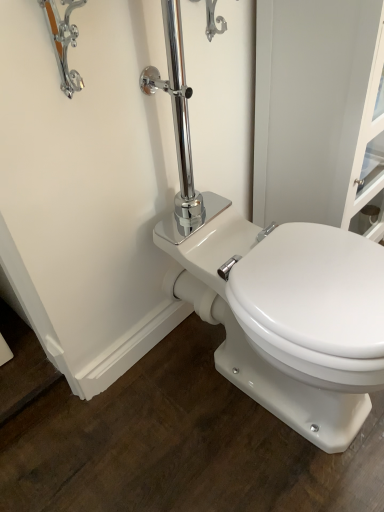
The image size is (384, 512). What do you see at coordinates (63, 41) in the screenshot?
I see `chrome metallic faucet at upper left` at bounding box center [63, 41].

Identify the location of white glossy screen door at upper right. (319, 113).

Identify the location of chrome metallic faucet at upper left. Image resolution: width=384 pixels, height=512 pixels. (63, 41).

Considering the points (75, 85) and (269, 333), which point is in front, point (75, 85) or point (269, 333)?

The point (75, 85) is closer to the camera.

In the scene shown: How many degrees apart are the facing directions of chrome metallic faucet at upper left and white glossy porcelain toilet at center?

There is a 0.0018-degree angle between the facing directions of chrome metallic faucet at upper left and white glossy porcelain toilet at center.

Is chrome metallic faucet at upper left in front of white glossy porcelain toilet at center?

Yes, it is.

From the image's perspective, which one is positioned higher, chrome metallic faucet at upper left or white glossy porcelain toilet at center?

chrome metallic faucet at upper left is shown above in the image.

The image size is (384, 512). Identify the location of faucet that appears above the white glossy screen door at upper right (from a real-world perspective). (63, 41).

From the image's perspective, is white glossy screen door at upper right above chrome metallic faucet at upper left?

No.

How much distance is there between white glossy screen door at upper right and chrome metallic faucet at upper left?

white glossy screen door at upper right and chrome metallic faucet at upper left are 25.18 inches apart from each other.

In terms of height, does white glossy screen door at upper right look taller or shorter compared to chrome metallic faucet at upper left?

white glossy screen door at upper right is taller than chrome metallic faucet at upper left.

Based on the photo, considering the relative sizes of white glossy screen door at upper right and white glossy porcelain toilet at center in the image provided, is white glossy screen door at upper right bigger than white glossy porcelain toilet at center?

Correct, white glossy screen door at upper right is larger in size than white glossy porcelain toilet at center.

Is white glossy screen door at upper right far away from white glossy porcelain toilet at center?

white glossy screen door at upper right is actually quite close to white glossy porcelain toilet at center.

Measure the distance between white glossy screen door at upper right and white glossy porcelain toilet at center.

They are 14.56 inches apart.

In the scene shown: Which is behind, white glossy screen door at upper right or white glossy porcelain toilet at center?

white glossy screen door at upper right is more distant.

Between chrome metallic faucet at upper left and white glossy screen door at upper right, which one has larger size?

white glossy screen door at upper right is bigger.

Can you confirm if chrome metallic faucet at upper left is thinner than white glossy screen door at upper right?

Indeed, chrome metallic faucet at upper left has a lesser width compared to white glossy screen door at upper right.

Is chrome metallic faucet at upper left not within white glossy screen door at upper right?

That's correct, chrome metallic faucet at upper left is outside of white glossy screen door at upper right.

Is chrome metallic faucet at upper left to the left or to the right of white glossy screen door at upper right in the image?

In the image, chrome metallic faucet at upper left appears on the left side of white glossy screen door at upper right.

Locate an element on the screen. Image resolution: width=384 pixels, height=512 pixels. screen door on the right of white glossy porcelain toilet at center is located at coordinates (319, 113).

Is white glossy screen door at upper right completely or partially inside white glossy porcelain toilet at center?

No, white glossy screen door at upper right is not surrounded by white glossy porcelain toilet at center.

Is white glossy porcelain toilet at center to the right of white glossy screen door at upper right from the viewer's perspective?

Incorrect, white glossy porcelain toilet at center is not on the right side of white glossy screen door at upper right.

Is white glossy porcelain toilet at center turned away from chrome metallic faucet at upper left?

That's not correct — white glossy porcelain toilet at center is not looking away from chrome metallic faucet at upper left.

Locate an element on the screen. toilet below the chrome metallic faucet at upper left (from a real-world perspective) is located at coordinates (288, 317).

Which is more distant, (360, 298) or (48, 29)?

The point (360, 298) is farther.

Identify the location of toilet below the chrome metallic faucet at upper left (from the image's perspective). [288, 317].

The image size is (384, 512). What are the coordinates of `faucet above the white glossy screen door at upper right (from the image's perspective)` in the screenshot? It's located at (63, 41).

Looking at the image, which one is located closer to chrome metallic faucet at upper left, white glossy porcelain toilet at center or white glossy screen door at upper right?

The object closer to chrome metallic faucet at upper left is white glossy screen door at upper right.

Which object lies nearer to the anchor point white glossy screen door at upper right, white glossy porcelain toilet at center or chrome metallic faucet at upper left?

white glossy porcelain toilet at center is closer to white glossy screen door at upper right.

Estimate the real-world distances between objects in this image. Which object is further from white glossy screen door at upper right, chrome metallic faucet at upper left or white glossy porcelain toilet at center?

chrome metallic faucet at upper left.

When comparing their distances from white glossy porcelain toilet at center, does chrome metallic faucet at upper left or white glossy screen door at upper right seem closer?

The object closer to white glossy porcelain toilet at center is white glossy screen door at upper right.

Based on their spatial positions, is white glossy screen door at upper right or white glossy porcelain toilet at center closer to chrome metallic faucet at upper left?

white glossy screen door at upper right is positioned closer to the anchor chrome metallic faucet at upper left.

Looking at the image, which one is located closer to white glossy porcelain toilet at center, white glossy screen door at upper right or chrome metallic faucet at upper left?

The object closer to white glossy porcelain toilet at center is white glossy screen door at upper right.

Where is `toilet between chrome metallic faucet at upper left and white glossy screen door at upper right in the horizontal direction`? toilet between chrome metallic faucet at upper left and white glossy screen door at upper right in the horizontal direction is located at coordinates (288, 317).